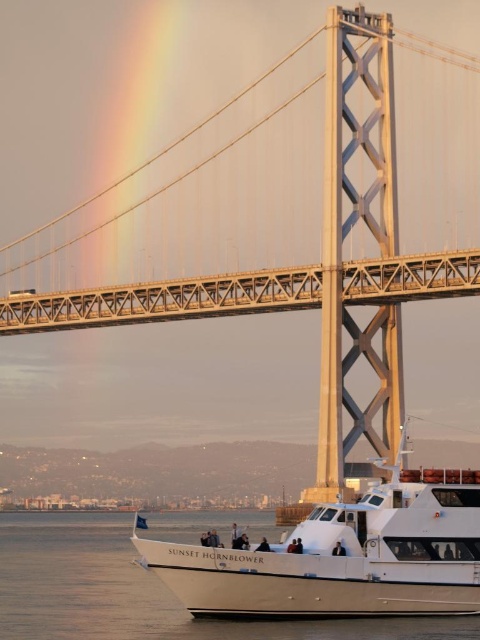
Can you confirm if white matte boat at lower right is positioned below white smooth water at lower center?

No, white matte boat at lower right is not below white smooth water at lower center.

This screenshot has width=480, height=640. Describe the element at coordinates (344, 556) in the screenshot. I see `white matte boat at lower right` at that location.

What are the coordinates of `white matte boat at lower right` in the screenshot? It's located at (344, 556).